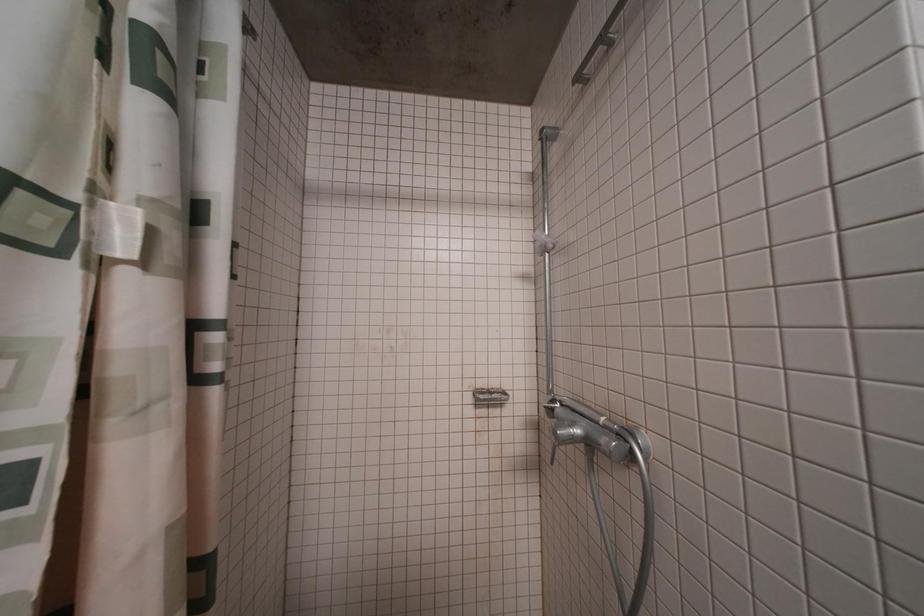
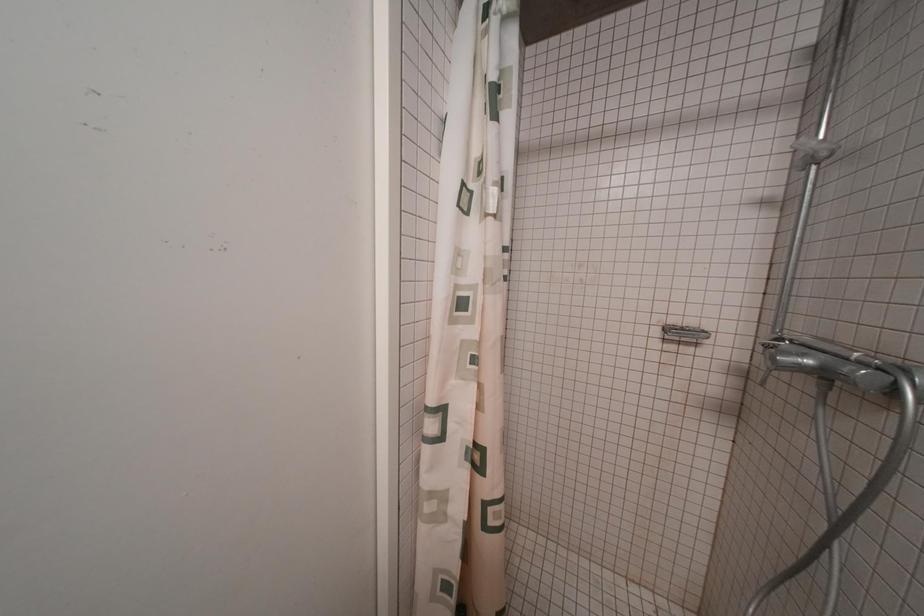
Question: The images are taken continuously from a first-person perspective. In which direction is your viewpoint rotating?

Choices:
 (A) Left
 (B) Right
 (C) Up
 (D) Down

Answer: (A)